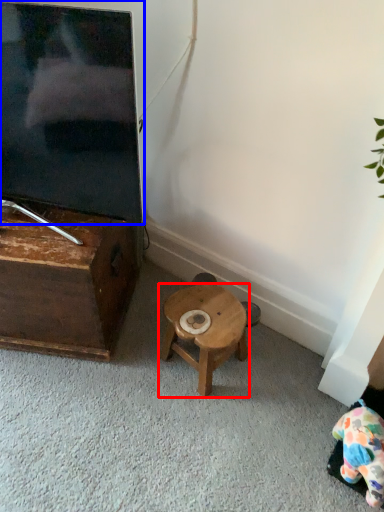
Question: Among these objects, which one is nearest to the camera, stool (highlighted by a red box) or television (highlighted by a blue box)?

Choices:
 (A) stool
 (B) television

Answer: (B)